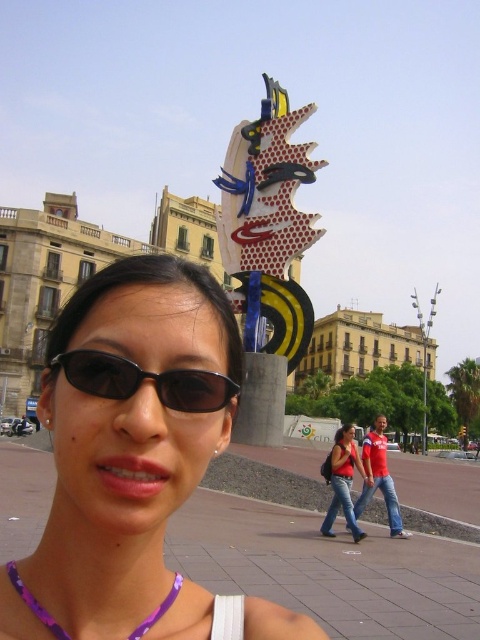
Question: From the image, what is the correct spatial relationship of black matte sunglasses at center in relation to red fabric shirt at center?

Choices:
 (A) above
 (B) below

Answer: (A)

Question: Which point is farther to the camera?

Choices:
 (A) matte red shirt at center
 (B) polychrome painted metal sculpture at center
 (C) red fabric shirt at center
 (D) black matte sunglasses at center

Answer: (C)

Question: Can you confirm if red fabric shirt at center is thinner than purple beaded necklace at lower center?

Choices:
 (A) yes
 (B) no

Answer: (B)

Question: Which object appears farthest from the camera in this image?

Choices:
 (A) red fabric shirt at center
 (B) matte red shirt at center
 (C) matte black sunglasses at center

Answer: (A)

Question: Which is farther from the matte black sunglasses at center?

Choices:
 (A) purple beaded necklace at lower center
 (B) polychrome painted metal sculpture at center
 (C) red fabric shirt at center
 (D) matte red shirt at center

Answer: (C)

Question: Is black matte sunglasses at center to the right of purple beaded necklace at lower center from the viewer's perspective?

Choices:
 (A) yes
 (B) no

Answer: (A)